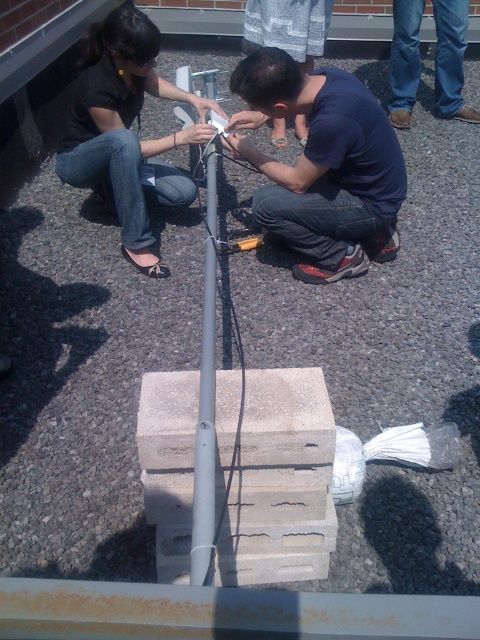
Question: Estimate the real-world distances between objects in this image. Which object is farther from the matte black shirt at upper left?

Choices:
 (A) gray metallic pole at center
 (B) dark blue shirt at center
 (C) blue jeans at upper right

Answer: (C)

Question: Which point is closer to the camera?

Choices:
 (A) (141, 147)
 (B) (304, 81)
 (C) (453, 60)

Answer: (B)

Question: From the image, what is the correct spatial relationship of matte black shirt at upper left in relation to gray metallic pole at center?

Choices:
 (A) above
 (B) below

Answer: (A)

Question: Does matte black shirt at upper left have a larger size compared to gray metallic pole at center?

Choices:
 (A) no
 (B) yes

Answer: (B)

Question: Considering the real-world distances, which object is closest to the gray metallic pole at center?

Choices:
 (A) dark blue shirt at center
 (B) matte black shirt at upper left
 (C) blue jeans at upper right

Answer: (B)

Question: Can you confirm if dark blue shirt at center is thinner than blue jeans at upper right?

Choices:
 (A) yes
 (B) no

Answer: (B)